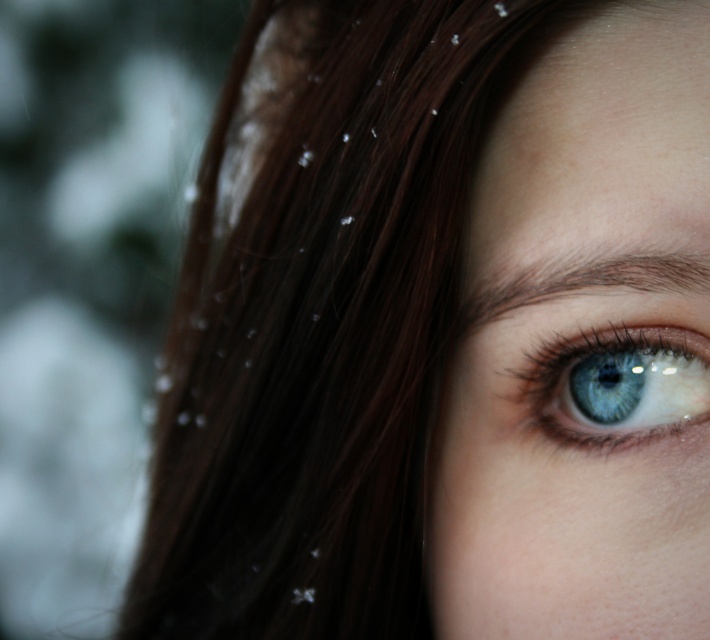
Question: Is matte brown hair at upper right to the right of blue glossy eye at center from the viewer's perspective?

Choices:
 (A) no
 (B) yes

Answer: (A)

Question: Which object is farther from the camera taking this photo?

Choices:
 (A) matte brown hair at upper right
 (B) blue glossy eye at center

Answer: (B)

Question: Which of the following is the farthest from the observer?

Choices:
 (A) click(x=594, y=435)
 (B) click(x=633, y=524)

Answer: (A)

Question: Is matte brown hair at upper right smaller than blue glossy eye at center?

Choices:
 (A) yes
 (B) no

Answer: (B)

Question: Which object is closer to the camera taking this photo?

Choices:
 (A) matte brown hair at upper right
 (B) blue glossy eye at center

Answer: (A)

Question: Can you confirm if matte brown hair at upper right is positioned to the right of blue glossy eye at center?

Choices:
 (A) no
 (B) yes

Answer: (A)